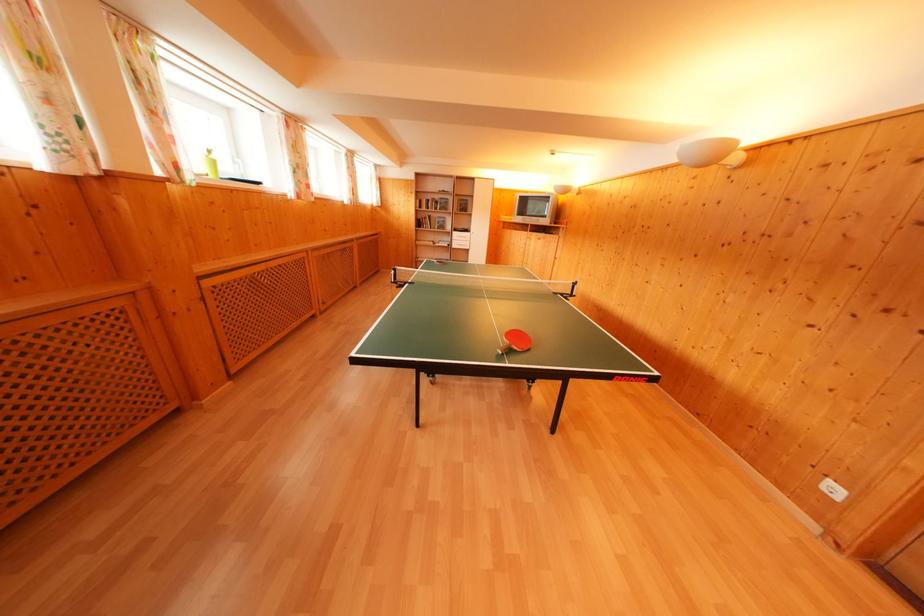
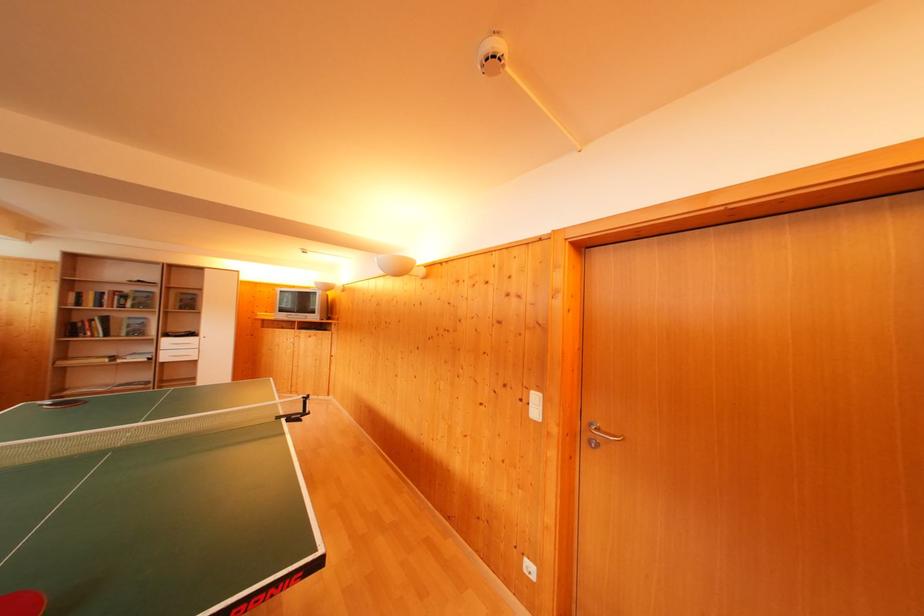
Where in the second image is the point corresponding to point (424, 228) from the first image?

(76, 334)